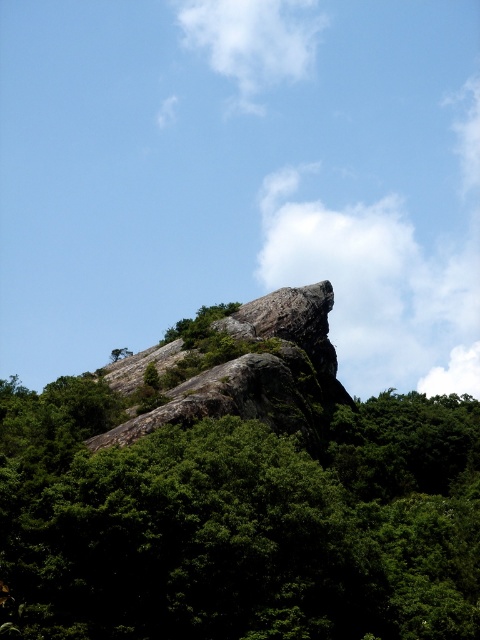
Question: Which object is closer to the camera taking this photo?

Choices:
 (A) rough granite rock at center
 (B) green leafy tree at center

Answer: (B)

Question: Is rough granite rock at center thinner than white fluffy cloud at upper center?

Choices:
 (A) yes
 (B) no

Answer: (A)

Question: Is green leafy tree at center further to camera compared to rough granite rock at center?

Choices:
 (A) no
 (B) yes

Answer: (A)

Question: Is green leafy tree at center to the right of rough granite rock at center from the viewer's perspective?

Choices:
 (A) yes
 (B) no

Answer: (A)

Question: Among these objects, which one is farthest from the camera?

Choices:
 (A) green leafy tree at center
 (B) white fluffy cloud at upper center

Answer: (B)

Question: Which point is farther from the camera taking this photo?

Choices:
 (A) (x=324, y=376)
 (B) (x=337, y=426)

Answer: (A)